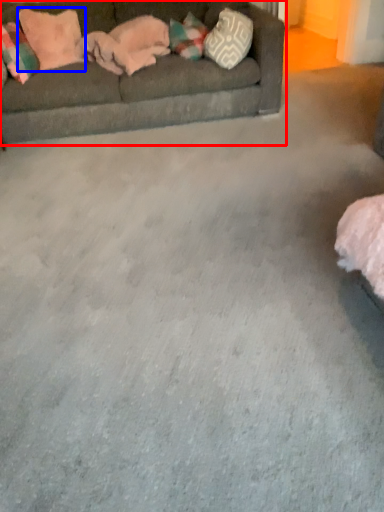
Question: Which object appears farthest to the camera in this image, studio couch (highlighted by a red box) or pillow (highlighted by a blue box)?

Choices:
 (A) studio couch
 (B) pillow

Answer: (B)